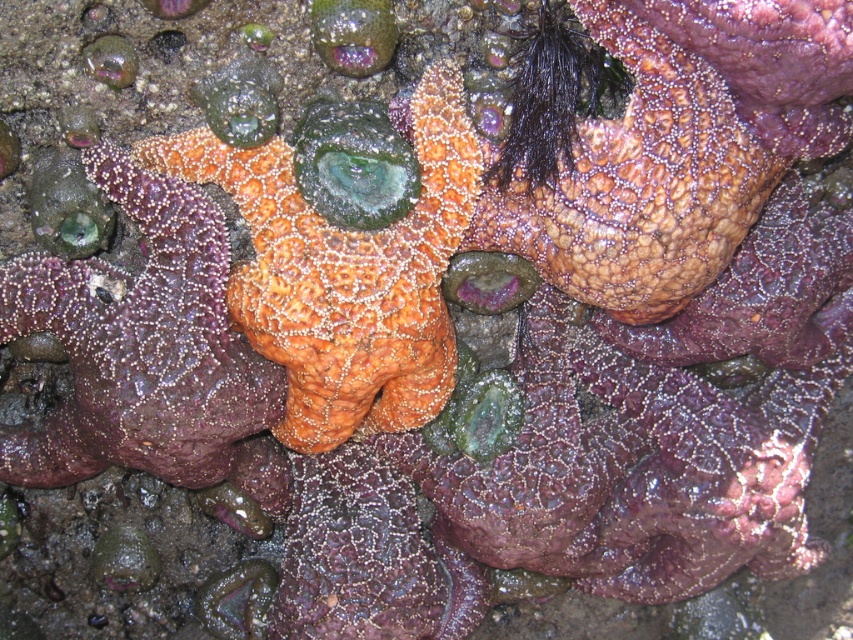
Between orange textured starfish at center and orange matte starfish at center, which one appears on the left side from the viewer's perspective?

orange matte starfish at center is more to the left.

Between point (287, 397) and point (161, 388), which one is positioned in front?

Point (161, 388) is in front.

What are the coordinates of `orange textured starfish at center` in the screenshot? It's located at (345, 273).

Is point (851, 44) positioned after point (103, 275)?

No, (851, 44) is closer to viewer.

Is rough textured starfish at center further to the viewer compared to orange matte starfish at center?

No, rough textured starfish at center is in front of orange matte starfish at center.

Which is in front, point (822, 93) or point (192, 412)?

Point (822, 93) is more forward.

I want to click on rough textured starfish at center, so click(677, 148).

Does point (585, 275) come in front of point (286, 362)?

No, (585, 275) is behind (286, 362).

Looking at this image, does rough textured starfish at center have a smaller size compared to orange textured starfish at center?

Actually, rough textured starfish at center might be larger than orange textured starfish at center.

This screenshot has height=640, width=853. What are the coordinates of `rough textured starfish at center` in the screenshot? It's located at (677, 148).